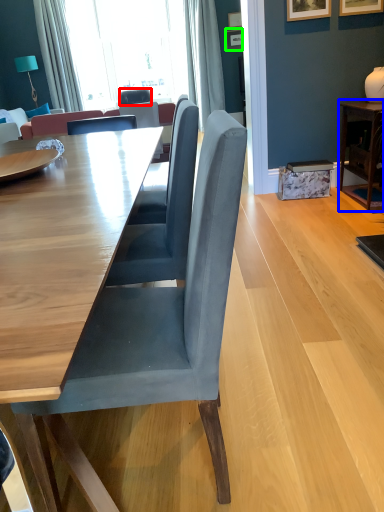
Question: Which object is positioned farthest from chair (highlighted by a red box)? Select from table (highlighted by a blue box) and picture frame (highlighted by a green box).

Choices:
 (A) table
 (B) picture frame

Answer: (A)